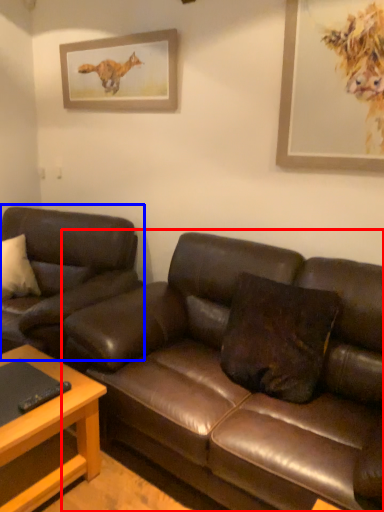
Question: Which object appears farthest to the camera in this image, studio couch (highlighted by a red box) or studio couch (highlighted by a blue box)?

Choices:
 (A) studio couch
 (B) studio couch

Answer: (B)